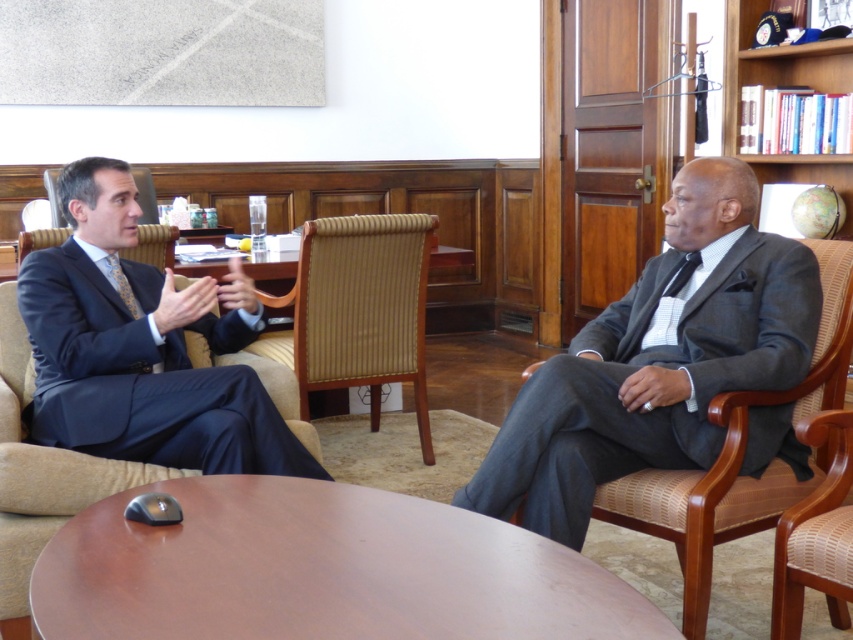
Which is behind, point (368, 545) or point (157, 406)?

The point (157, 406) is behind.

Image resolution: width=853 pixels, height=640 pixels. In order to click on brown wood round table at center in this screenshot , I will do `click(321, 570)`.

Which is above, matte black suit at left or wooden armchair at right?

matte black suit at left is above.

Does matte black suit at left have a larger size compared to wooden armchair at right?

Yes, matte black suit at left is bigger than wooden armchair at right.

Measure the distance between matte black suit at left and camera.

They are 2.22 meters apart.

Locate an element on the screen. This screenshot has height=640, width=853. matte black suit at left is located at coordinates (142, 348).

Can you confirm if wooden armchair at right is smaller than wooden bookshelf at upper right?

Incorrect, wooden armchair at right is not smaller in size than wooden bookshelf at upper right.

Image resolution: width=853 pixels, height=640 pixels. Identify the location of wooden armchair at right. (740, 456).

I want to click on wooden armchair at right, so click(740, 456).